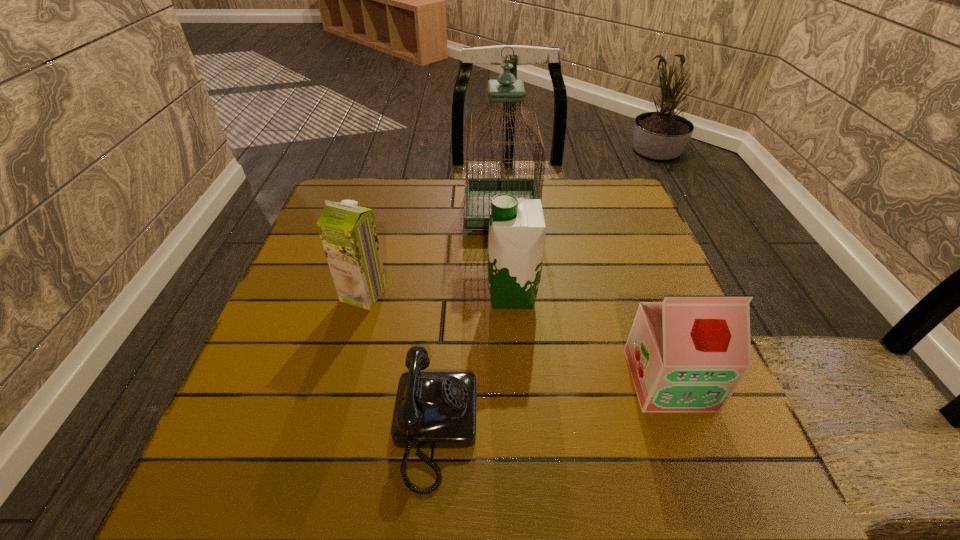
At what (x,y) coordinates should I click in order to perform the action: click on free region at the far edge of the desktop. Please return your answer as a coordinate pair (x, y). This screenshot has height=540, width=960. Looking at the image, I should click on (576, 221).

In the image, there is a desktop. In order to click on vacant space at the near edge in this screenshot , I will do `click(482, 468)`.

Locate an element on the screen. The height and width of the screenshot is (540, 960). free space at the left edge of the desktop is located at coordinates (306, 249).

Find the location of a particular element. vacant space at the right edge of the desktop is located at coordinates (667, 285).

Locate an element on the screen. The width and height of the screenshot is (960, 540). vacant space at the far right corner is located at coordinates (626, 204).

Identify the location of free space that is in between the second soya milk from right to left and the rightmost object. (590, 338).

I want to click on vacant space that's between the tallest object and the telephone, so click(468, 322).

Where is `unoccupied area between the rightmost soya milk and the birdcage`? unoccupied area between the rightmost soya milk and the birdcage is located at coordinates (586, 297).

At what (x,y) coordinates should I click in order to perform the action: click on free spot between the telephone and the leftmost object. Please return your answer as a coordinate pair (x, y). This screenshot has height=540, width=960. Looking at the image, I should click on (399, 361).

Locate an element on the screen. The width and height of the screenshot is (960, 540). free space that is in between the second soya milk from left to right and the nearest soya milk is located at coordinates (590, 338).